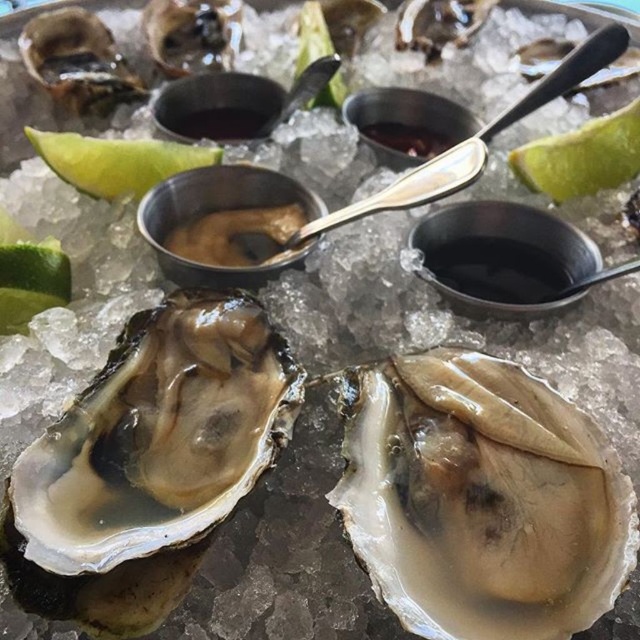
Between point (205, 524) and point (547, 177), which one is positioned behind?

The point (547, 177) is behind.

From the picture: Is translucent shell oyster at center closer to the viewer compared to green matte lime at upper right?

Yes, translucent shell oyster at center is closer to the viewer.

Who is more forward, (141, 310) or (557, 144)?

Point (141, 310)

This screenshot has height=640, width=640. In order to click on translucent shell oyster at center in this screenshot , I will do `click(157, 435)`.

Between shiny pearl oyster at center and translucent shell oyster at center, which one is positioned lower?

Positioned lower is shiny pearl oyster at center.

Based on the photo, can you confirm if shiny pearl oyster at center is shorter than translucent shell oyster at center?

Indeed, shiny pearl oyster at center has a lesser height compared to translucent shell oyster at center.

Image resolution: width=640 pixels, height=640 pixels. Identify the location of shiny pearl oyster at center. (483, 499).

Does translucent shell oyster at center have a smaller size compared to green matte lime at upper left?

Actually, translucent shell oyster at center might be larger than green matte lime at upper left.

Is translucent shell oyster at center bigger than green matte lime at upper left?

Correct, translucent shell oyster at center is larger in size than green matte lime at upper left.

The image size is (640, 640). Find the location of `translucent shell oyster at center`. translucent shell oyster at center is located at coordinates [157, 435].